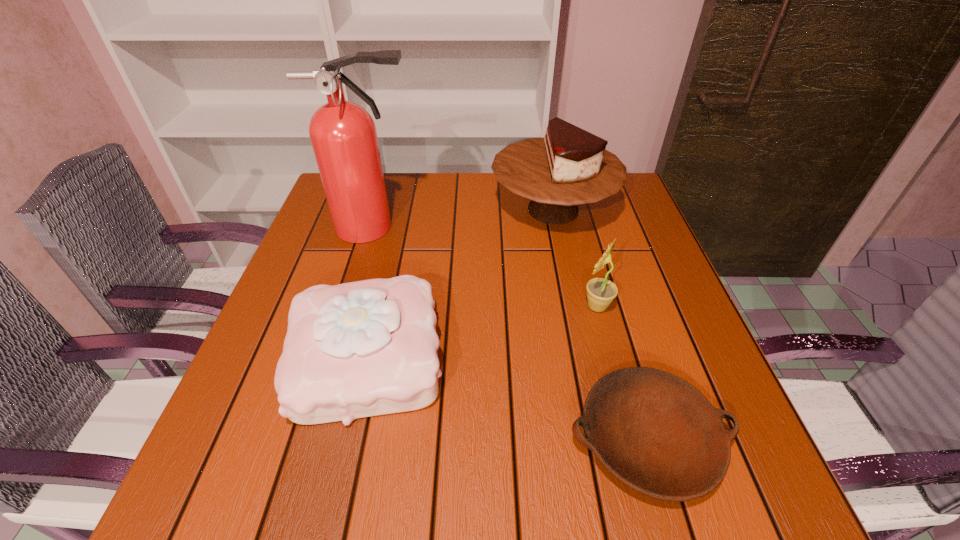
At what (x,y) coordinates should I click in order to perform the action: click on sunflower that is at the right edge. Please return your answer as a coordinate pair (x, y). Image resolution: width=960 pixels, height=540 pixels. Looking at the image, I should click on (600, 291).

Locate an element on the screen. The height and width of the screenshot is (540, 960). plate located at the right edge is located at coordinates (655, 432).

Identify the location of object at the far left corner. (343, 134).

Where is `object that is at the far right corner`? The height and width of the screenshot is (540, 960). object that is at the far right corner is located at coordinates (569, 166).

Find the location of a particular element. object situated at the near right corner is located at coordinates (655, 432).

Where is `free location at the far edge of the desktop`? The width and height of the screenshot is (960, 540). free location at the far edge of the desktop is located at coordinates (422, 216).

In the image, there is a desktop. At what (x,y) coordinates should I click in order to perform the action: click on free region at the left edge. Please return your answer as a coordinate pair (x, y). The height and width of the screenshot is (540, 960). Looking at the image, I should click on (225, 434).

Locate an element on the screen. The height and width of the screenshot is (540, 960). free spot at the right edge of the desktop is located at coordinates (635, 220).

In order to click on vacant region at the near left corner in this screenshot , I will do `click(240, 479)`.

Locate an element on the screen. vacant space at the far right corner is located at coordinates (626, 203).